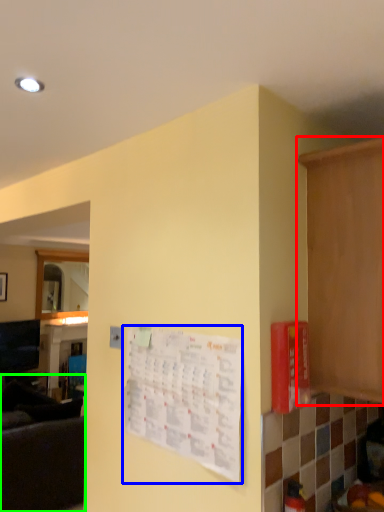
Question: Which object is the closest to the cabinetry (highlighted by a red box)? Choose among these: bulletin board (highlighted by a blue box) or couch (highlighted by a green box).

Choices:
 (A) bulletin board
 (B) couch

Answer: (A)